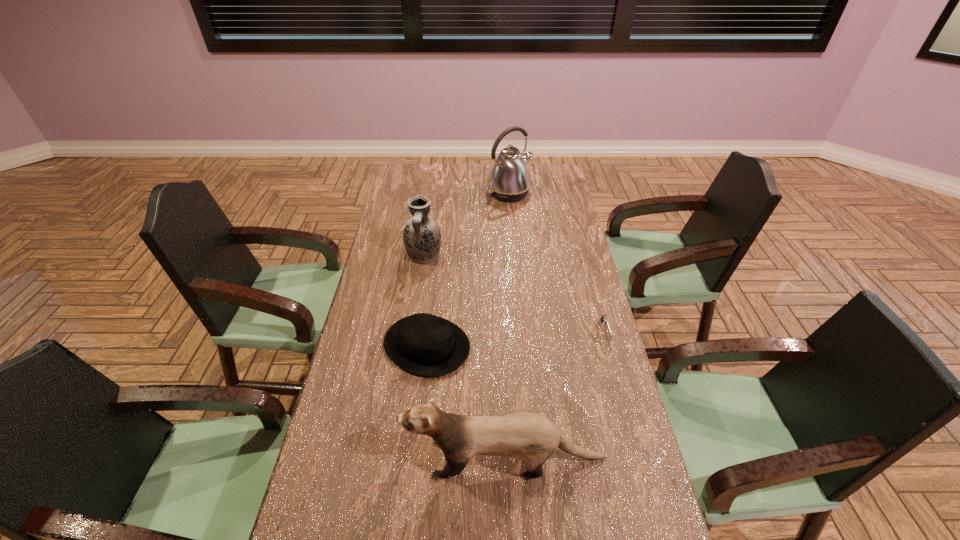
At what (x,y) coordinates should I click in order to perform the action: click on free space at the right edge of the desktop. Please return your answer as a coordinate pair (x, y). Looking at the image, I should click on (545, 237).

Find the location of a particular element. vacant space at the far left corner of the desktop is located at coordinates (410, 176).

Identify the location of blank space at the far right corner of the desktop. This screenshot has width=960, height=540. (558, 171).

What are the coordinates of `free spot between the second shortest object and the nearest object` in the screenshot? It's located at (467, 402).

In order to click on free space between the farthest object and the ferret in this screenshot , I will do `click(508, 326)`.

At what (x,y) coordinates should I click in order to perform the action: click on free space between the pistol and the fourth nearest object. Please return your answer as a coordinate pair (x, y). Looking at the image, I should click on (515, 295).

This screenshot has height=540, width=960. What are the coordinates of `vacant area that lies between the farthest object and the shortest object` in the screenshot? It's located at (558, 264).

Identify the location of vacant point located between the shortest object and the fourth nearest object. (515, 295).

Find the location of a particular element. The height and width of the screenshot is (540, 960). unoccupied position between the fourth tallest object and the vase is located at coordinates (425, 301).

Find the location of a particular element. free point between the fourth tallest object and the vase is located at coordinates (425, 301).